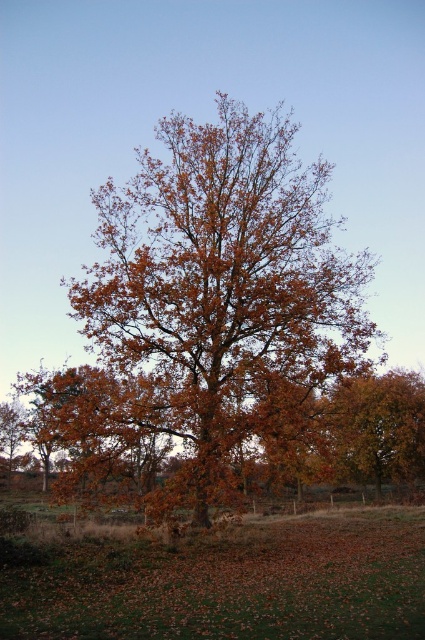
Question: Is orange-brown wood oak tree at center further to the viewer compared to orange-brown leaves at center?

Choices:
 (A) no
 (B) yes

Answer: (A)

Question: Can you confirm if orange-brown wood oak tree at center is positioned below orange-brown leaves at center?

Choices:
 (A) no
 (B) yes

Answer: (A)

Question: Which object appears closest to the camera in this image?

Choices:
 (A) orange-brown wood oak tree at center
 (B) orange-brown leaves at center

Answer: (A)

Question: Among these objects, which one is farthest from the camera?

Choices:
 (A) orange-brown wood oak tree at center
 (B) orange-brown leaves at center

Answer: (B)

Question: Does orange-brown wood oak tree at center have a smaller size compared to orange-brown leaves at center?

Choices:
 (A) no
 (B) yes

Answer: (A)